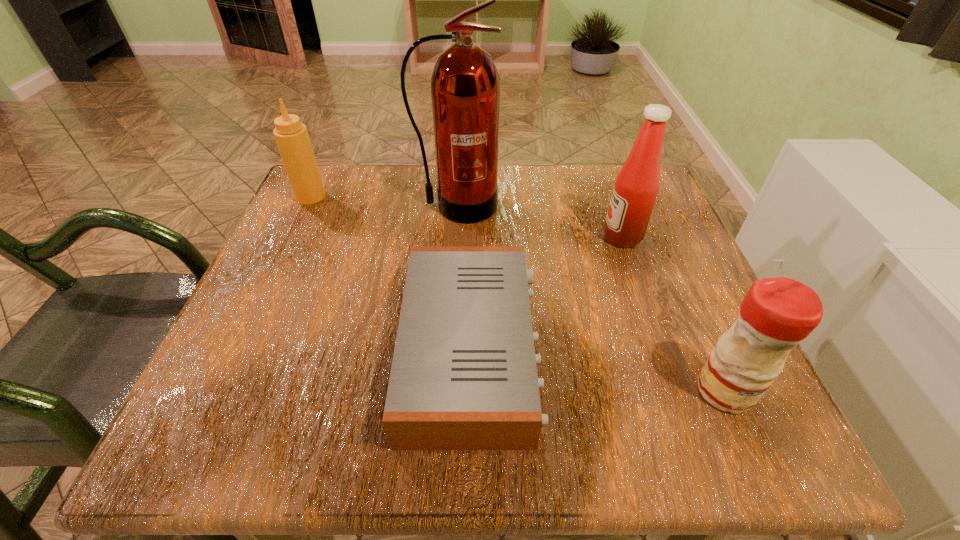
The height and width of the screenshot is (540, 960). In order to click on vacant space that satisfies the following two spatial constraints: 1. on the control panel of the nearest condiment; 2. on the left side of the radio receiver in this screenshot , I will do tap(471, 390).

Identify the location of blank space that satisfies the following two spatial constraints: 1. on the control panel of the nearest condiment; 2. on the left side of the radio receiver. The height and width of the screenshot is (540, 960). (471, 390).

The width and height of the screenshot is (960, 540). I want to click on free space that satisfies the following two spatial constraints: 1. on the back side of the nearest condiment; 2. on the control panel of the shortest object, so click(707, 350).

This screenshot has width=960, height=540. I want to click on free space that satisfies the following two spatial constraints: 1. on the control panel of the nearest condiment; 2. on the left side of the shortest object, so coord(471,390).